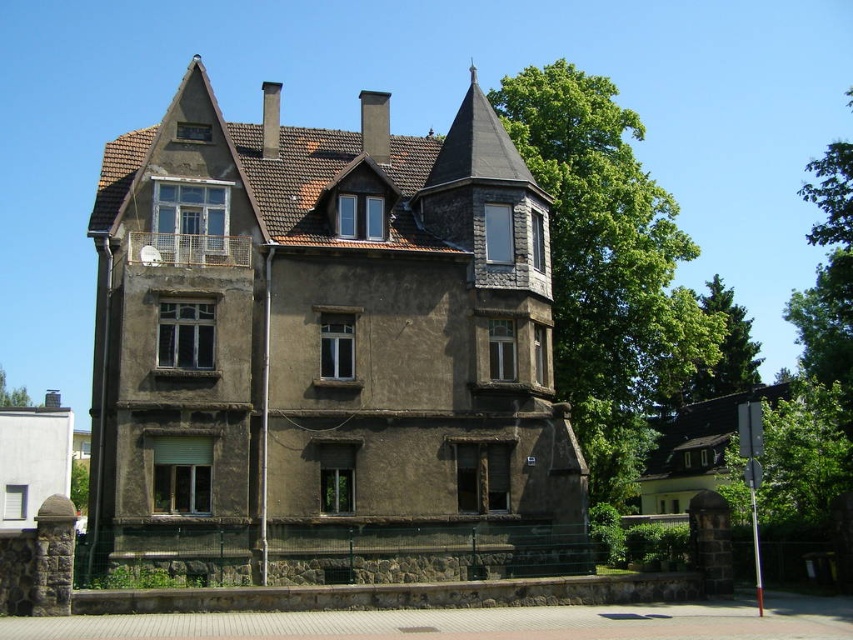
Please provide the coordinates of the dark brown stone tower at center in the image. The coordinate system uses the bottom left corner as the origin point. The answer should be in the format of point followed by coordinates in parentheses. For example, point 0.5,0.5. Please do not add any other information besides the answer.

point (326, 339)

You are an architect designing a new garden layout. You need to place a decorative fountain between the dark brown stone tower at center and the green leafy tree at upper center. Based on their widths, which object should the fountain be closer to?

The dark brown stone tower at center has a smaller width than the green leafy tree at upper center, so the fountain should be placed closer to the dark brown stone tower at center to balance the visual weight between the two objects.

You are standing in front of the residential building and want to take a photo that includes both the dark brown stone tower at center and the green leafy tree at upper center. Based on their positions, which object should you position to the left side of your camera frame to include both in the shot?

To include both the dark brown stone tower at center and the green leafy tree at upper center in your photo, you should position the green leafy tree at upper center to the left side of your camera frame since the dark brown stone tower at center is to the right of the green leafy tree at upper center.